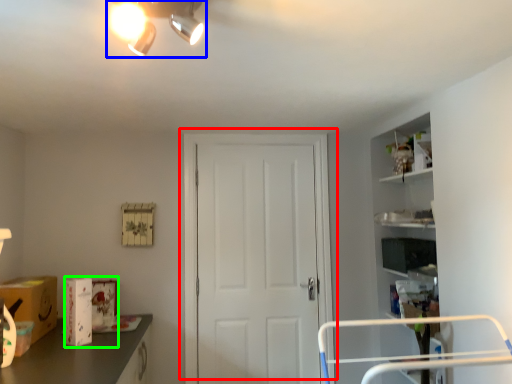
Question: Which object is positioned closest to door (highlighted by a red box)? Select from light fixture (highlighted by a blue box) and box (highlighted by a green box).

Choices:
 (A) light fixture
 (B) box

Answer: (B)